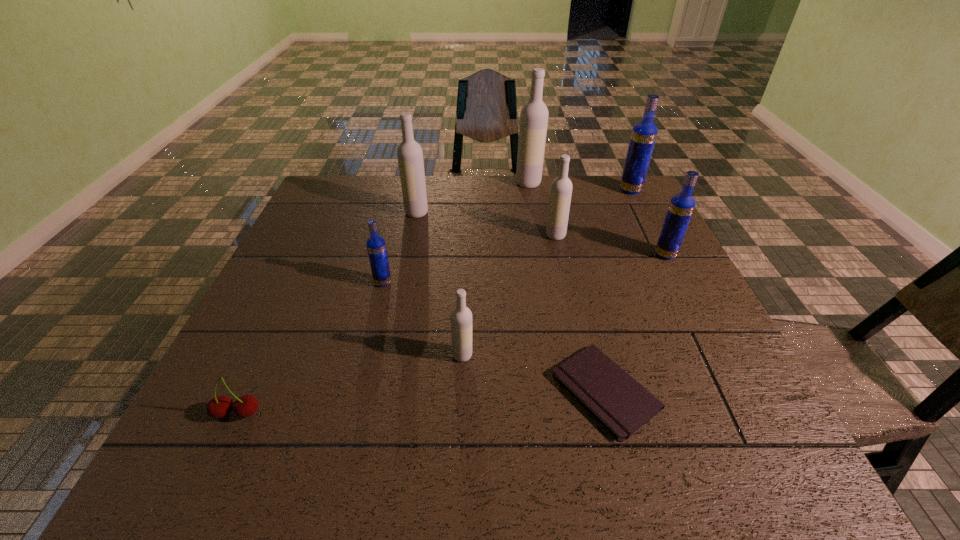
Select which blue vodka is the third closest to the tallest object. Please provide its 2D coordinates. Your answer should be formatted as a tuple, i.e. [(x, y)], where the tuple contains the x and y coordinates of a point satisfying the conditions above.

[(376, 247)]

Where is `free space that satisfies the following two spatial constraints: 1. on the front side of the farthest blue vodka; 2. on the left side of the tallest object`? The width and height of the screenshot is (960, 540). free space that satisfies the following two spatial constraints: 1. on the front side of the farthest blue vodka; 2. on the left side of the tallest object is located at coordinates (530, 190).

Find the location of `free space that satisfies the following two spatial constraints: 1. on the back side of the third farthest white vodka; 2. on the right side of the fourth object from left to right`. free space that satisfies the following two spatial constraints: 1. on the back side of the third farthest white vodka; 2. on the right side of the fourth object from left to right is located at coordinates (468, 235).